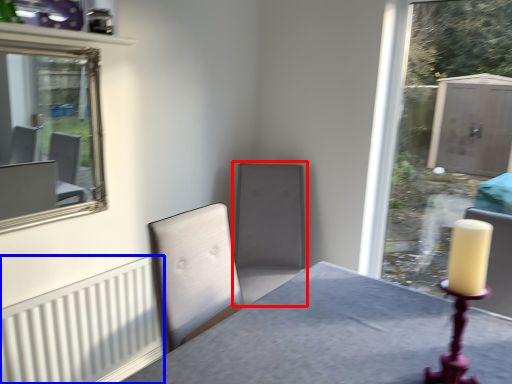
Question: Which object is further to the camera taking this photo, swivel chair (highlighted by a red box) or radiator (highlighted by a blue box)?

Choices:
 (A) swivel chair
 (B) radiator

Answer: (A)